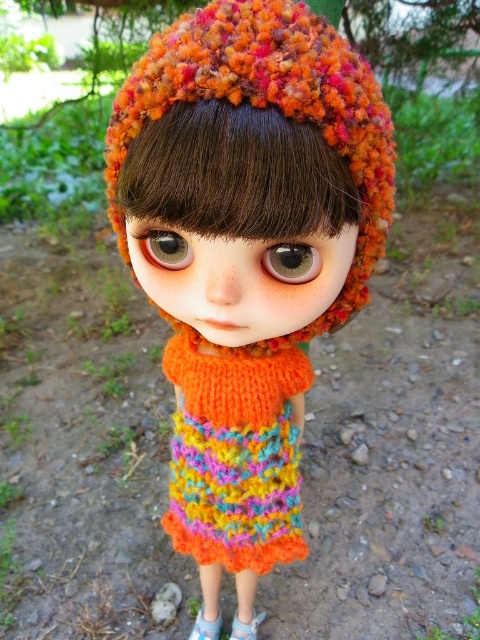
You are a photographer trying to capture the doll from the front. Which object will appear closer to the camera between the knitted orange hat at center and the multicolored knitted dress at center?

The knitted orange hat at center will appear closer to the camera because it is in front of the multicolored knitted dress at center.

You are a tailor who needs to pack the knitted orange hat at center and the multicolored knitted dress at center into a box. The box has a maximum length of 4 inches. Can both items fit side by side in the box without overlapping?

The knitted orange hat at center and multicolored knitted dress at center are 4.50 inches apart, which exceeds the box length of 4 inches. Therefore, they cannot fit side by side in the box without overlapping.